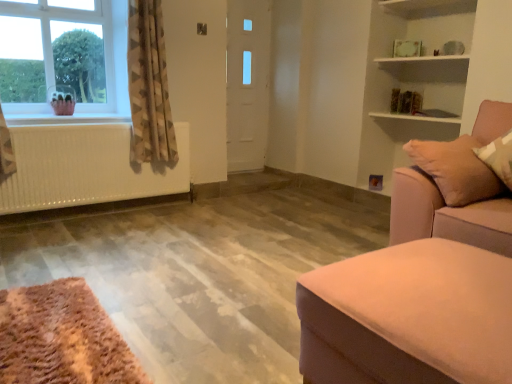
Question: Is suede-like beige studio couch at right, which is the 1th studio couch from back to front, thinner than white matte radiator at left?

Choices:
 (A) yes
 (B) no

Answer: (B)

Question: Is suede-like beige studio couch at right, the 2th studio couch positioned from the front, bigger than white matte radiator at left?

Choices:
 (A) yes
 (B) no

Answer: (A)

Question: Can you confirm if suede-like beige studio couch at right, which is the 1th studio couch from back to front, is taller than white matte radiator at left?

Choices:
 (A) no
 (B) yes

Answer: (B)

Question: Does suede-like beige studio couch at right, the 2th studio couch positioned from the front, have a greater width compared to white matte radiator at left?

Choices:
 (A) no
 (B) yes

Answer: (B)

Question: Does suede-like beige studio couch at right, the 2th studio couch positioned from the front, touch white matte radiator at left?

Choices:
 (A) yes
 (B) no

Answer: (B)

Question: From the image's perspective, is white glossy door at center located above or below beige textured curtain at left?

Choices:
 (A) above
 (B) below

Answer: (A)

Question: Does point (266, 26) appear closer or farther from the camera than point (132, 114)?

Choices:
 (A) closer
 (B) farther

Answer: (B)

Question: Considering their positions, is white glossy door at center located in front of or behind beige textured curtain at left?

Choices:
 (A) behind
 (B) front

Answer: (A)

Question: Considering the positions of white glossy door at center and beige textured curtain at left in the image, is white glossy door at center bigger or smaller than beige textured curtain at left?

Choices:
 (A) big
 (B) small

Answer: (B)

Question: Relative to suede-like beige studio couch at right, the 2th studio couch positioned from the front, is clear glass window at upper left in front or behind?

Choices:
 (A) front
 (B) behind

Answer: (B)

Question: Based on their sizes in the image, would you say clear glass window at upper left is bigger or smaller than suede-like beige studio couch at right, which is the 1th studio couch from back to front?

Choices:
 (A) small
 (B) big

Answer: (A)

Question: Is point (38, 96) positioned closer to the camera than point (402, 241)?

Choices:
 (A) farther
 (B) closer

Answer: (A)

Question: Visually, is clear glass window at upper left positioned to the left or to the right of suede-like beige studio couch at right, the 2th studio couch positioned from the front?

Choices:
 (A) left
 (B) right

Answer: (A)

Question: Is beige textured curtain at left to the left or to the right of white matte radiator at left in the image?

Choices:
 (A) left
 (B) right

Answer: (B)

Question: From the image's perspective, is beige textured curtain at left located above or below white matte radiator at left?

Choices:
 (A) below
 (B) above

Answer: (B)